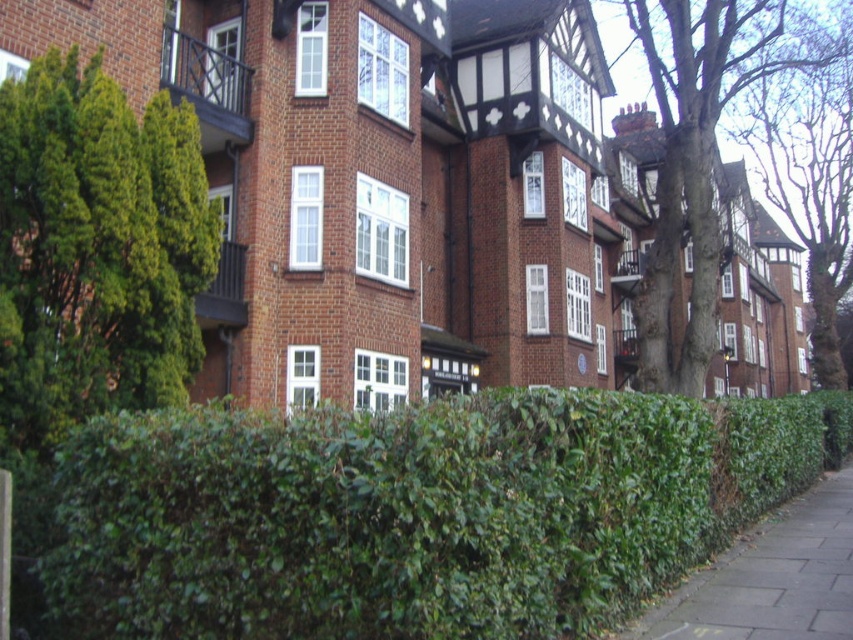
You are standing on the sidewalk in front of the brick buildings and want to take a photo of both the green leafy tree at left and the bare bark tree at upper right. Which tree should you focus on first to ensure both are in the frame?

You should focus on the green leafy tree at left first because it is closer to the viewer than the bare bark tree at upper right, so adjusting the camera to include both would require ensuring the closer tree is centered before including the farther one.

You are a city planner assessing the urban landscape. You notice the green leafy tree at left and the bare bark tree at upper right. Which tree is taller?

The bare bark tree at upper right is taller than the green leafy tree at left.